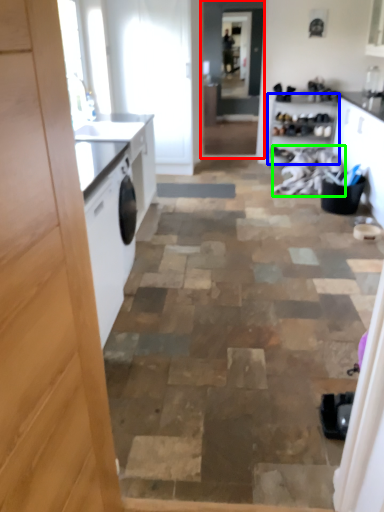
Question: Based on their relative distances, which object is nearer to screen door (highlighted by a red box)? Choose from cabinetry (highlighted by a blue box) and laundry (highlighted by a green box).

Choices:
 (A) cabinetry
 (B) laundry

Answer: (A)